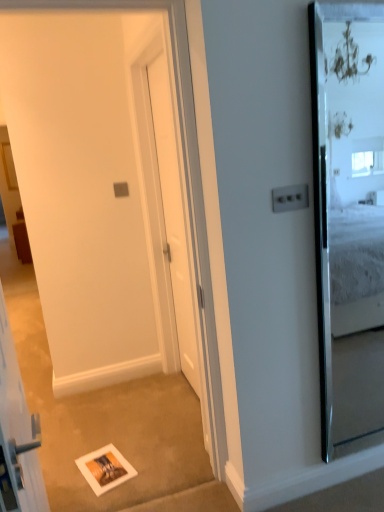
The width and height of the screenshot is (384, 512). In order to click on white glossy picture frame at lower center in this screenshot , I will do `click(105, 469)`.

Where is `white glossy elevator at lower left`? The width and height of the screenshot is (384, 512). white glossy elevator at lower left is located at coordinates (17, 434).

I want to click on white glossy picture frame at lower center, so click(x=105, y=469).

In terms of width, does white glossy elevator at lower left look wider or thinner when compared to white glossy door at center?

white glossy elevator at lower left is wider than white glossy door at center.

Image resolution: width=384 pixels, height=512 pixels. Identify the location of screen door positioned vertically above the white glossy elevator at lower left (from a real-world perspective). (180, 234).

In the image, is white glossy elevator at lower left positioned in front of or behind clear glass mirror at right?

In the image, white glossy elevator at lower left appears in front of clear glass mirror at right.

Where is `elevator located underneath the clear glass mirror at right (from a real-world perspective)`? Image resolution: width=384 pixels, height=512 pixels. elevator located underneath the clear glass mirror at right (from a real-world perspective) is located at coordinates (17, 434).

Which is more to the left, white glossy elevator at lower left or clear glass mirror at right?

Positioned to the left is white glossy elevator at lower left.

How different are the orientations of white glossy elevator at lower left and clear glass mirror at right in degrees?

93.6 degrees.

Is white glossy elevator at lower left bigger than white matte barn door at center?

Incorrect, white glossy elevator at lower left is not larger than white matte barn door at center.

Find the location of a particular element. The width and height of the screenshot is (384, 512). elevator below the white matte barn door at center (from the image's perspective) is located at coordinates (17, 434).

Who is more distant, white glossy elevator at lower left or white matte barn door at center?

white matte barn door at center is more distant.

Is white matte barn door at center at the back of white glossy elevator at lower left?

white glossy elevator at lower left does not have its back to white matte barn door at center.

Is white glossy door at center turned away from clear glass mirror at right?

white glossy door at center is not turned away from clear glass mirror at right.

How many degrees apart are the facing directions of white glossy door at center and clear glass mirror at right?

They differ by 92.7 degrees in their facing directions.

Considering the positions of objects white glossy door at center and clear glass mirror at right in the image provided, who is in front, white glossy door at center or clear glass mirror at right?

clear glass mirror at right is closer to the camera.

Based on the photo, from their relative heights in the image, would you say white matte barn door at center is taller or shorter than white glossy elevator at lower left?

Considering their sizes, white matte barn door at center has more height than white glossy elevator at lower left.

Is white matte barn door at center oriented away from white glossy elevator at lower left?

That's not correct — white matte barn door at center is not looking away from white glossy elevator at lower left.

Consider the image. Considering the sizes of objects white matte barn door at center and white glossy elevator at lower left in the image provided, who is bigger, white matte barn door at center or white glossy elevator at lower left?

Bigger between the two is white matte barn door at center.

In the scene shown: In terms of width, does white matte barn door at center look wider or thinner when compared to white glossy elevator at lower left?

Considering their sizes, white matte barn door at center looks broader than white glossy elevator at lower left.

Considering the positions of point (105, 473) and point (173, 114), is point (105, 473) closer or farther from the camera than point (173, 114)?

Point (105, 473) is closer to the camera than point (173, 114).

Is white glossy picture frame at lower center to the left of white glossy door at center from the viewer's perspective?

Indeed, white glossy picture frame at lower center is positioned on the left side of white glossy door at center.

This screenshot has width=384, height=512. In order to click on screen door located above the white glossy picture frame at lower center (from the image's perspective) in this screenshot , I will do `click(180, 234)`.

From a real-world perspective, is white glossy picture frame at lower center on top of white glossy door at center?

Actually, white glossy picture frame at lower center is physically below white glossy door at center in the real world.

Is clear glass mirror at right facing away from white glossy elevator at lower left?

No, clear glass mirror at right is not facing away from white glossy elevator at lower left.

Considering the relative sizes of clear glass mirror at right and white glossy elevator at lower left in the image provided, is clear glass mirror at right taller than white glossy elevator at lower left?

Indeed, clear glass mirror at right has a greater height compared to white glossy elevator at lower left.

Looking at this image, from the image's perspective, is clear glass mirror at right above or below white glossy elevator at lower left?

clear glass mirror at right is situated higher than white glossy elevator at lower left in the image.

Where is `elevator below the white glossy door at center (from a real-world perspective)`? elevator below the white glossy door at center (from a real-world perspective) is located at coordinates (17, 434).

Identify the location of elevator lying in front of the clear glass mirror at right. This screenshot has height=512, width=384. (17, 434).

From the image, which object appears to be nearer to clear glass mirror at right, white glossy picture frame at lower center or white glossy door at center?

white glossy door at center is positioned closer to the anchor clear glass mirror at right.

In the scene shown: Considering their positions, is white glossy elevator at lower left positioned further to clear glass mirror at right than white glossy picture frame at lower center?

Based on the image, white glossy elevator at lower left appears to be further to clear glass mirror at right.

From the image, which object appears to be farther from white matte barn door at center, clear glass mirror at right or white glossy picture frame at lower center?

Based on the image, clear glass mirror at right appears to be further to white matte barn door at center.

Estimate the real-world distances between objects in this image. Which object is further from white glossy elevator at lower left, white glossy door at center or white matte barn door at center?

white matte barn door at center is further to white glossy elevator at lower left.

From the image, which object appears to be nearer to clear glass mirror at right, white glossy picture frame at lower center or white glossy elevator at lower left?

white glossy picture frame at lower center is closer to clear glass mirror at right.

From the image, which object appears to be nearer to white glossy picture frame at lower center, clear glass mirror at right or white matte barn door at center?

white matte barn door at center is positioned closer to the anchor white glossy picture frame at lower center.

Which object lies nearer to the anchor point white matte barn door at center, white glossy door at center or white glossy elevator at lower left?

Among the two, white glossy door at center is located nearer to white matte barn door at center.

Which object lies nearer to the anchor point white glossy picture frame at lower center, white matte barn door at center or white glossy elevator at lower left?

The object closer to white glossy picture frame at lower center is white glossy elevator at lower left.

Locate an element on the screen. screen door between white glossy elevator at lower left and white glossy picture frame at lower center along the z-axis is located at coordinates (180, 234).

At what (x,y) coordinates should I click in order to perform the action: click on barn door situated between white glossy picture frame at lower center and clear glass mirror at right from left to right. Please return your answer as a coordinate pair (x, y). The height and width of the screenshot is (512, 384). Looking at the image, I should click on (91, 191).

At what (x,y) coordinates should I click in order to perform the action: click on screen door between white matte barn door at center and clear glass mirror at right in the horizontal direction. Please return your answer as a coordinate pair (x, y). Looking at the image, I should click on (180, 234).

Find the location of a particular element. picture frame between white glossy elevator at lower left and clear glass mirror at right from left to right is located at coordinates (105, 469).